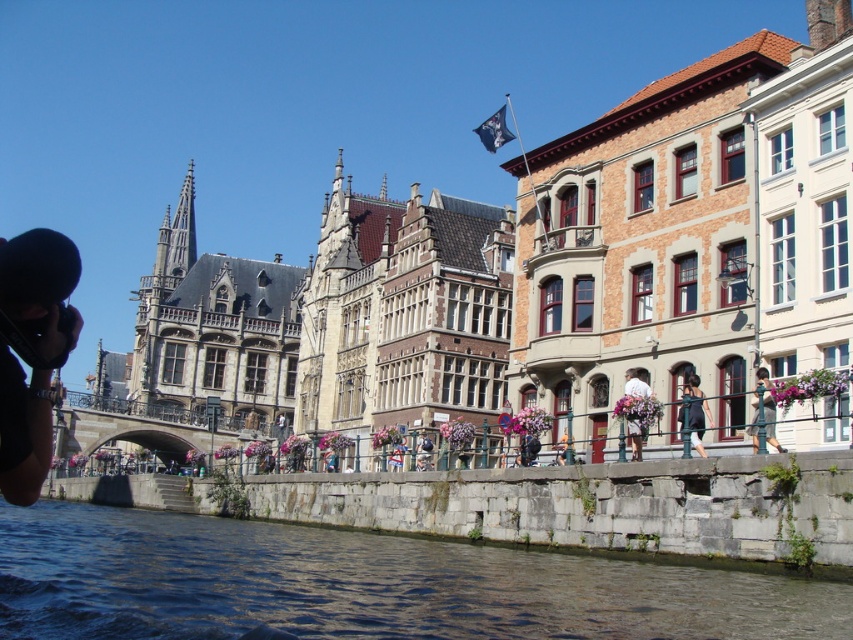
Between point (97, 570) and point (691, 419), which one is positioned in front?

Positioned in front is point (97, 570).

Does point (241, 609) come closer to viewer compared to point (699, 445)?

Yes.

This screenshot has width=853, height=640. What are the coordinates of `clear water at lower center` in the screenshot? It's located at (363, 584).

Which is more to the right, clear water at lower center or green dress at lower right?

From the viewer's perspective, green dress at lower right appears more on the right side.

Between clear water at lower center and green dress at lower right, which one appears on the left side from the viewer's perspective?

clear water at lower center is more to the left.

Which is in front, point (569, 595) or point (770, 428)?

Positioned in front is point (569, 595).

In order to click on clear water at lower center in this screenshot , I will do `click(363, 584)`.

Does point (683, 424) lie behind point (759, 385)?

Yes, point (683, 424) is farther from viewer.

Who is lower down, black satin dress at center or green dress at lower right?

black satin dress at center is lower down.

Find the location of a particular element. This screenshot has width=853, height=640. black satin dress at center is located at coordinates (693, 413).

Locate an element on the screen. black satin dress at center is located at coordinates (693, 413).